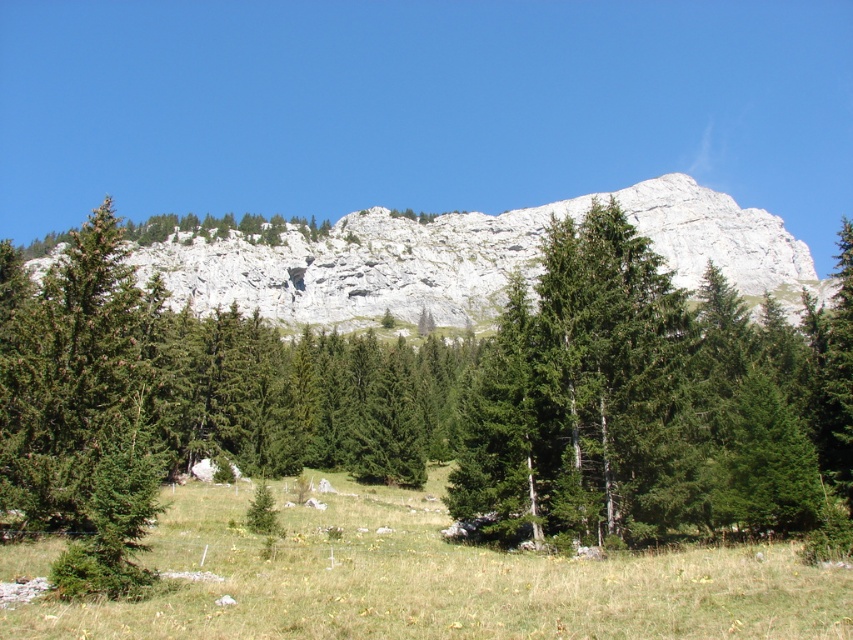
Question: Does green grassy field at lower center appear under white rocky mountain at upper center?

Choices:
 (A) yes
 (B) no

Answer: (A)

Question: Is green grassy field at lower center positioned before white rocky mountain at upper center?

Choices:
 (A) no
 (B) yes

Answer: (B)

Question: Where is green grassy field at lower center located in relation to white rocky mountain at upper center in the image?

Choices:
 (A) below
 (B) above

Answer: (A)

Question: Among these points, which one is farthest from the camera?

Choices:
 (A) (207, 563)
 (B) (733, 257)

Answer: (B)